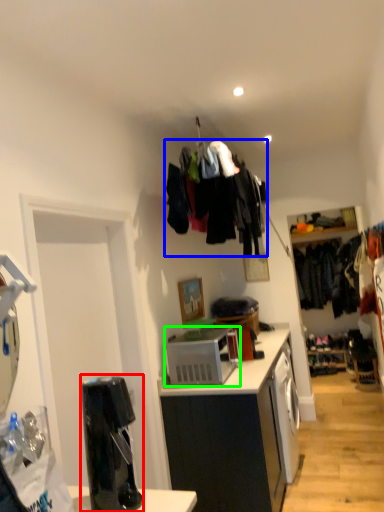
Question: Based on their relative distances, which object is farther from coffee machine (highlighted by a red box)? Choose from clothing (highlighted by a blue box) and microwave oven (highlighted by a green box).

Choices:
 (A) clothing
 (B) microwave oven

Answer: (A)